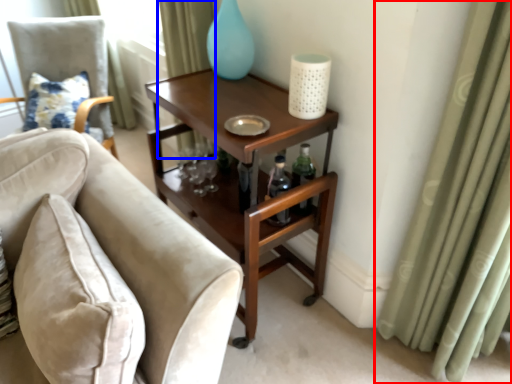
Question: Among these objects, which one is farthest to the camera, curtain (highlighted by a red box) or curtain (highlighted by a blue box)?

Choices:
 (A) curtain
 (B) curtain

Answer: (B)